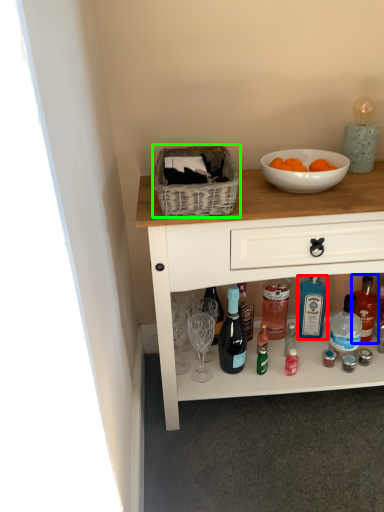
Question: Which object is the farthest from bottle (highlighted by a red box)? Choose among these: bottle (highlighted by a blue box) or picnic basket (highlighted by a green box).

Choices:
 (A) bottle
 (B) picnic basket

Answer: (B)